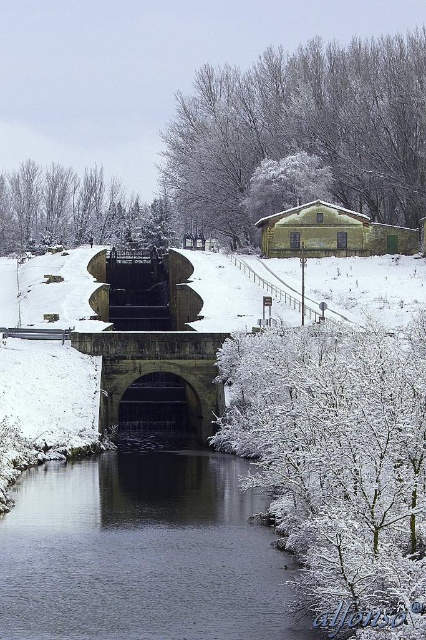
You are an architect designing a new pathway near the dark gray water at center and the white frosty tree at upper center. Since you need to know which area is wider to plan the pathway layout, can you determine which one has a greater width?

The white frosty tree at upper center has a greater width than the dark gray water at center, so the pathway should be planned accordingly to accommodate the wider area.

You are an artist planning to paint this winter scene. You want to ensure the white frosty branches at lower right and stone arch bridge at center are proportionally accurate. Based on the scene, which object should you draw wider in your painting?

The white frosty branches at lower right should be drawn wider than the stone arch bridge at center because their width surpasses the bridge.

You are standing on the stone bridge and looking down at the scene. Which object, the white frosty branches at lower right or the dark gray water at center, is closer to your eye level?

The white frosty branches at lower right are closer to your eye level because they are taller than the dark gray water at center.